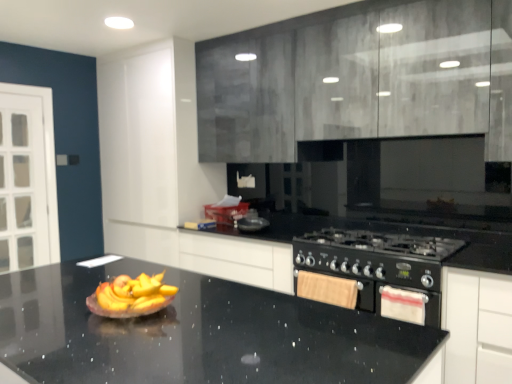
Question: Considering the positions of white fabric oven at lower right and black matte gas stove at lower right in the image, is white fabric oven at lower right taller or shorter than black matte gas stove at lower right?

Choices:
 (A) tall
 (B) short

Answer: (A)

Question: Relative to black matte gas stove at lower right, is white fabric oven at lower right in front or behind?

Choices:
 (A) behind
 (B) front

Answer: (A)

Question: Which object is the farthest from the matte gray cabinets at upper center?

Choices:
 (A) black granite countertop at center
 (B) white fabric oven at lower right
 (C) black matte gas stove at lower right

Answer: (A)

Question: Which object is the farthest from the black matte gas stove at lower right?

Choices:
 (A) matte gray cabinets at upper center
 (B) white fabric oven at lower right
 (C) black granite countertop at center

Answer: (C)